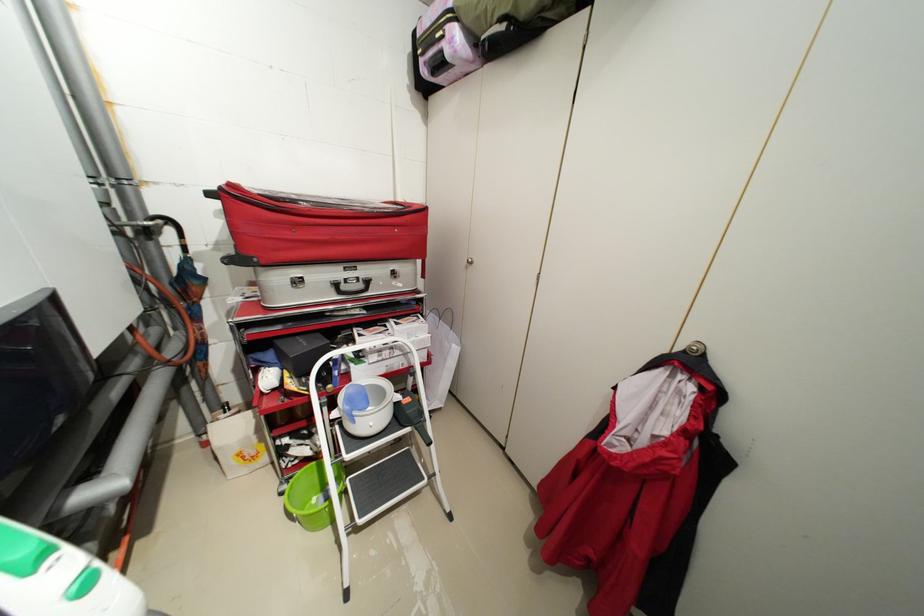
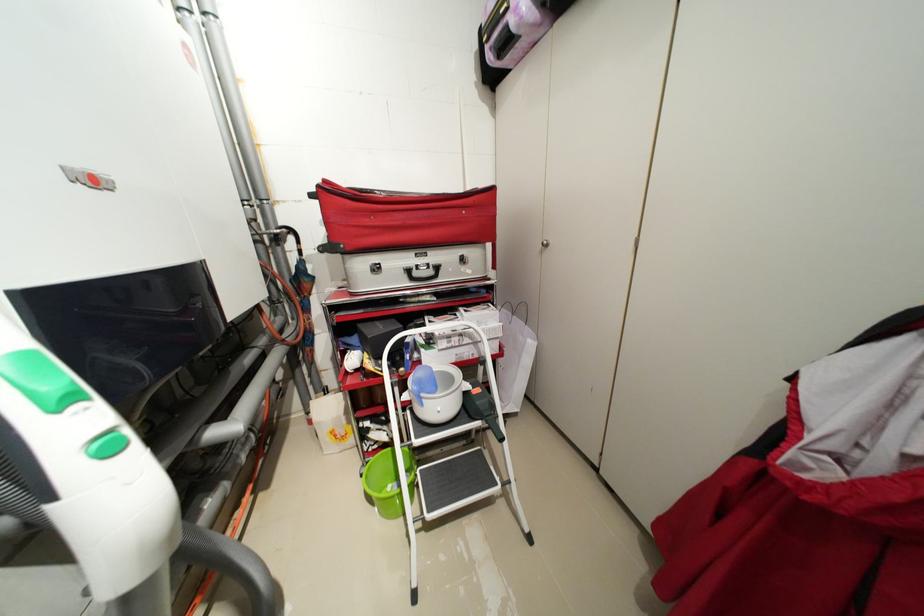
Where in the second image is the point corresponding to the point at 342,415 from the first image?

(412, 398)